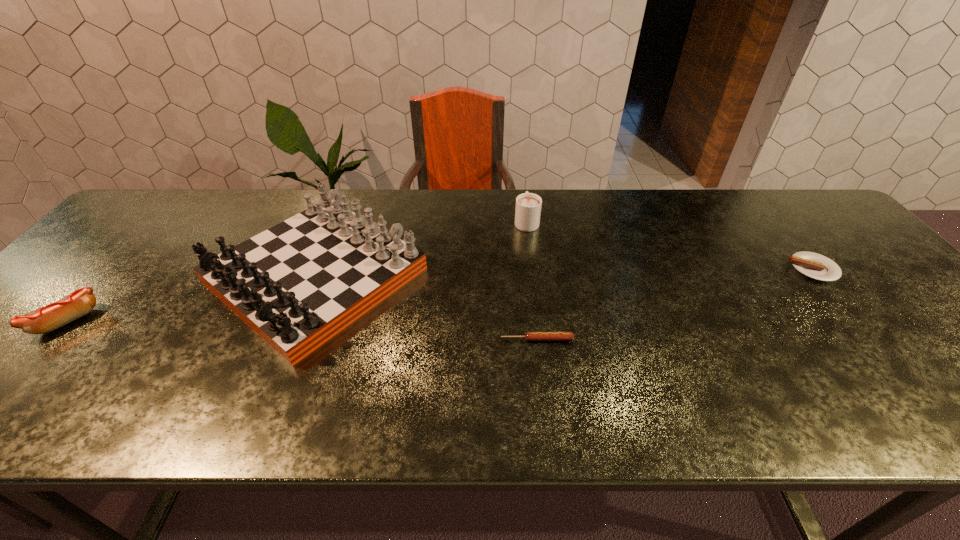
Locate an element on the screen. Image resolution: width=960 pixels, height=540 pixels. free space in the image that satisfies the following two spatial constraints: 1. on the back side of the tallest sausage; 2. on the left side of the tallest object is located at coordinates (109, 275).